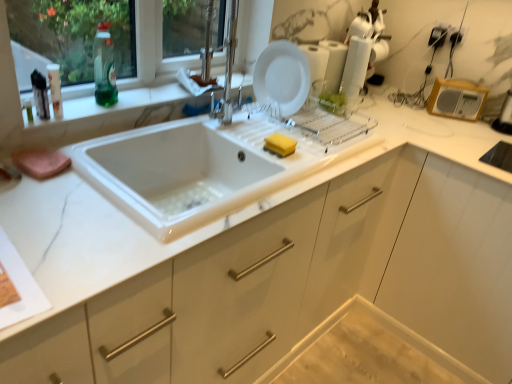
Locate an element on the screen. vacant space behind yellow sponge at sink is located at coordinates (278, 132).